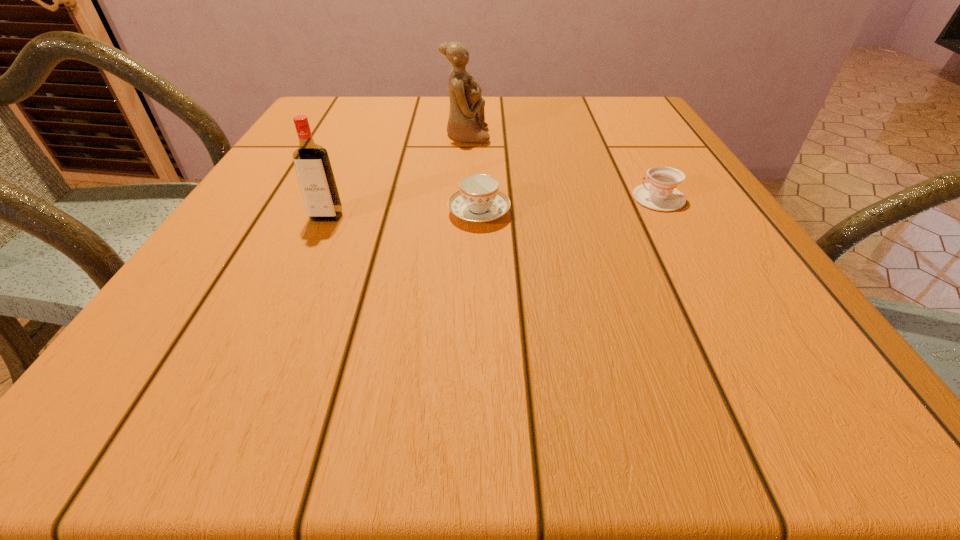
Locate an element on the screen. Image resolution: width=960 pixels, height=540 pixels. the farthest object is located at coordinates (466, 121).

This screenshot has width=960, height=540. Find the location of `vodka`. vodka is located at coordinates (315, 175).

You are a GUI agent. You are given a task and a screenshot of the screen. Output one action in this format:
    pyautogui.click(x=<x>, y=<y>)
    Task: Click on the taller teacup
    
    Given the screenshot: What is the action you would take?
    [478, 200]

The height and width of the screenshot is (540, 960). I want to click on the left teacup, so click(x=478, y=200).

The height and width of the screenshot is (540, 960). In order to click on the shorter teacup in this screenshot , I will do `click(660, 194)`.

Locate an element on the screen. The width and height of the screenshot is (960, 540). the rightmost object is located at coordinates (660, 194).

Locate an element on the screen. Image resolution: width=960 pixels, height=540 pixels. free space located on the front-facing side of the farthest object is located at coordinates (590, 136).

Where is `free location located 0.210m on the front and back of the vodka`? Image resolution: width=960 pixels, height=540 pixels. free location located 0.210m on the front and back of the vodka is located at coordinates (285, 308).

This screenshot has height=540, width=960. In order to click on vacant space located on the side with the handle of the left teacup in this screenshot , I will do `click(479, 127)`.

Locate an element on the screen. vacant space located 0.200m on the side with the handle of the left teacup is located at coordinates (479, 149).